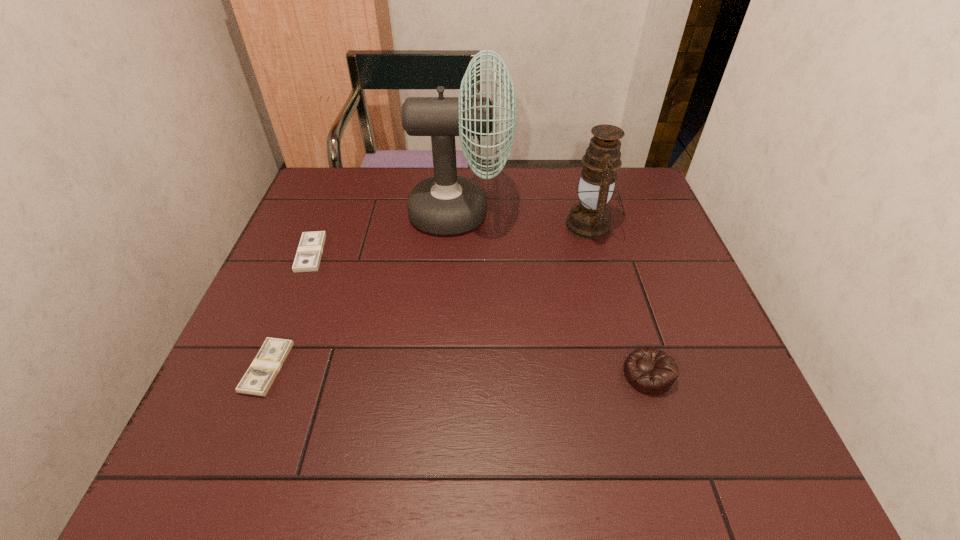
I want to click on free space located on the right of the nearer dollar, so click(397, 368).

The height and width of the screenshot is (540, 960). I want to click on fan that is at the far edge, so click(x=446, y=204).

This screenshot has width=960, height=540. What are the coordinates of `oil lamp that is at the far edge` in the screenshot? It's located at (590, 219).

Where is `oil lamp positioned at the right edge`? oil lamp positioned at the right edge is located at coordinates (590, 219).

The image size is (960, 540). Find the location of `beanbag situated at the right edge`. beanbag situated at the right edge is located at coordinates (651, 371).

Locate an element on the screen. Image resolution: width=960 pixels, height=540 pixels. object located at the far right corner is located at coordinates (590, 219).

Identify the location of vacant area at the far edge of the desktop. The width and height of the screenshot is (960, 540). (372, 173).

Where is `vacant space at the near edge of the desktop`? This screenshot has width=960, height=540. vacant space at the near edge of the desktop is located at coordinates (384, 448).

Find the location of a particular element. This screenshot has height=540, width=960. vacant space at the left edge of the desktop is located at coordinates (x=265, y=302).

In the image, there is a desktop. In order to click on free region at the right edge in this screenshot , I will do `click(739, 392)`.